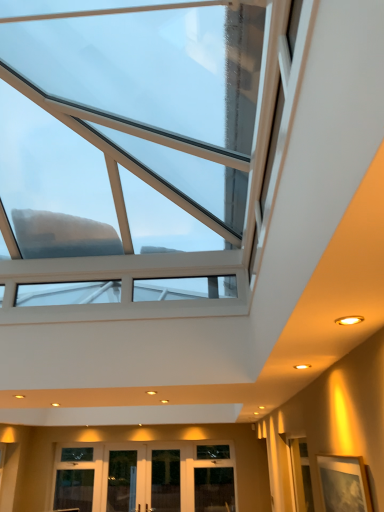
Question: Is transparent glass skylight at upper center in front of transparent glass door at center, the 1th glass door positioned from the right?

Choices:
 (A) no
 (B) yes

Answer: (B)

Question: Can you confirm if transparent glass skylight at upper center is smaller than transparent glass door at center, the 1th glass door positioned from the right?

Choices:
 (A) no
 (B) yes

Answer: (A)

Question: Would you consider transparent glass skylight at upper center to be distant from transparent glass door at center, the 3th glass door when ordered from left to right?

Choices:
 (A) yes
 (B) no

Answer: (A)

Question: Is transparent glass skylight at upper center behind transparent glass door at center, the 1th glass door positioned from the right?

Choices:
 (A) no
 (B) yes

Answer: (A)

Question: From a real-world perspective, is transparent glass skylight at upper center physically below transparent glass door at center, the 3th glass door when ordered from left to right?

Choices:
 (A) no
 (B) yes

Answer: (A)

Question: Considering their positions, is transparent glass door at center, the 1th glass door positioned from the right, located in front of or behind wooden picture frame at lower right?

Choices:
 (A) front
 (B) behind

Answer: (B)

Question: Looking at their shapes, would you say transparent glass door at center, the 1th glass door positioned from the right, is wider or thinner than wooden picture frame at lower right?

Choices:
 (A) wide
 (B) thin

Answer: (A)

Question: From the image's perspective, is transparent glass door at center, the 1th glass door positioned from the right, above or below wooden picture frame at lower right?

Choices:
 (A) above
 (B) below

Answer: (B)

Question: Considering the positions of transparent glass door at center, the 3th glass door when ordered from left to right, and wooden picture frame at lower right in the image, is transparent glass door at center, the 3th glass door when ordered from left to right, taller or shorter than wooden picture frame at lower right?

Choices:
 (A) short
 (B) tall

Answer: (B)

Question: Is transparent glass skylight at upper center inside the boundaries of transparent glass door at center, the 1th glass door positioned from the right, or outside?

Choices:
 (A) inside
 (B) outside

Answer: (B)

Question: In terms of width, does transparent glass skylight at upper center look wider or thinner when compared to transparent glass door at center, the 3th glass door when ordered from left to right?

Choices:
 (A) thin
 (B) wide

Answer: (B)

Question: In terms of size, does transparent glass skylight at upper center appear bigger or smaller than transparent glass door at center, the 1th glass door positioned from the right?

Choices:
 (A) small
 (B) big

Answer: (B)

Question: From the image's perspective, is transparent glass skylight at upper center located above or below transparent glass door at center, the 3th glass door when ordered from left to right?

Choices:
 (A) above
 (B) below

Answer: (A)

Question: From the image's perspective, relative to transparent glass door at lower center, the 3th glass door positioned from the right, is wooden picture frame at lower right above or below?

Choices:
 (A) below
 (B) above

Answer: (B)

Question: From their relative heights in the image, would you say wooden picture frame at lower right is taller or shorter than transparent glass door at lower center, placed as the first glass door when sorted from left to right?

Choices:
 (A) short
 (B) tall

Answer: (A)